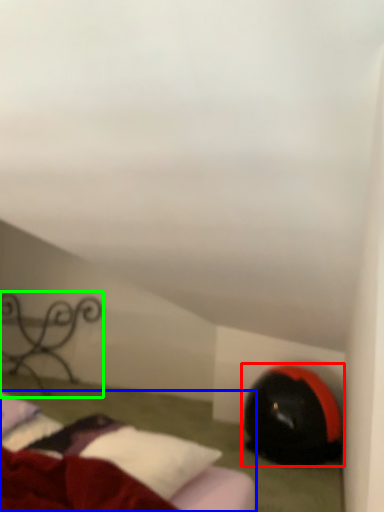
Question: Considering the real-world distances, which object is farthest from bean bag chair (highlighted by a red box)? bed (highlighted by a blue box) or furniture (highlighted by a green box)?

Choices:
 (A) bed
 (B) furniture

Answer: (B)